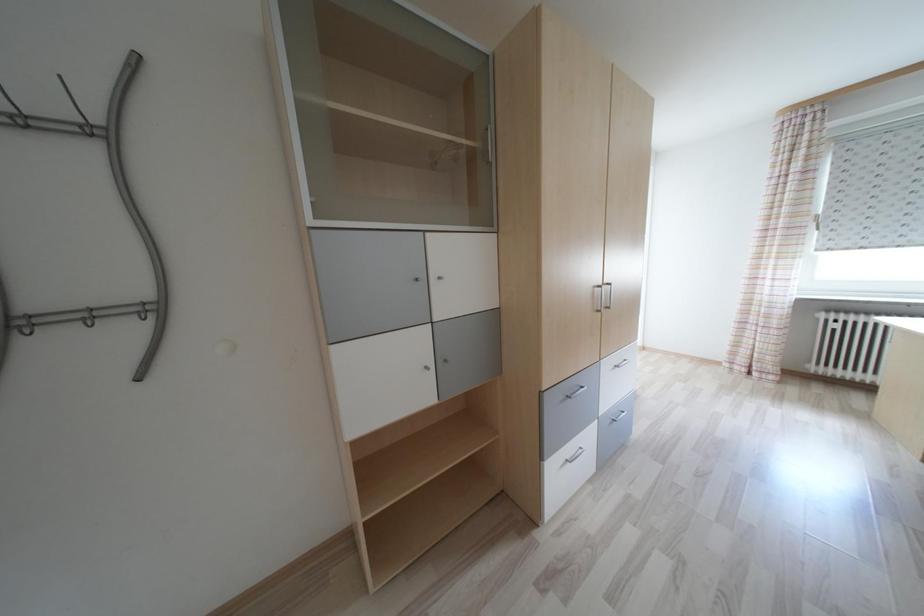
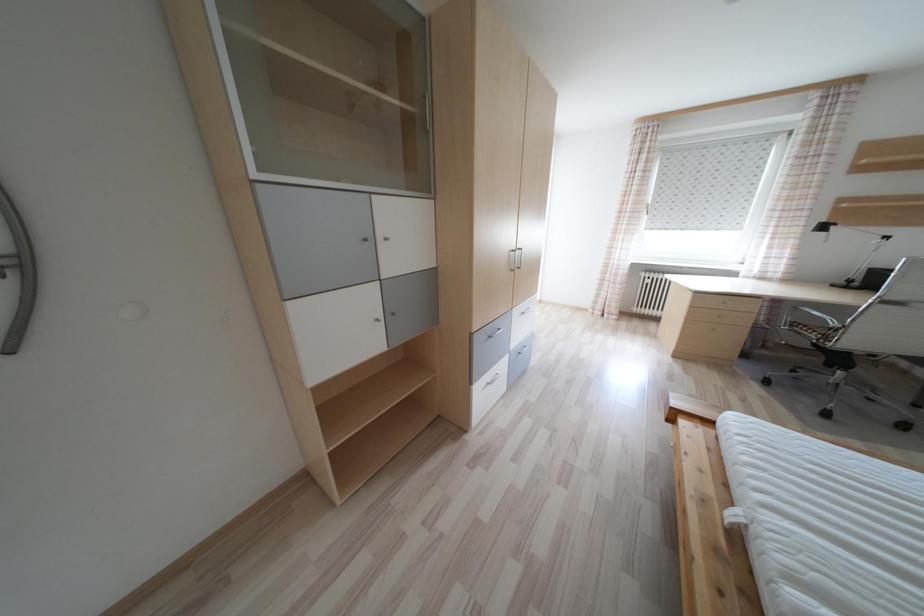
Question: The camera is either moving clockwise (left) or counter-clockwise (right) around the object. The first image is from the beginning of the video and the second image is from the end. Is the camera moving left or right when shooting the video?

Choices:
 (A) Left
 (B) Right

Answer: (A)